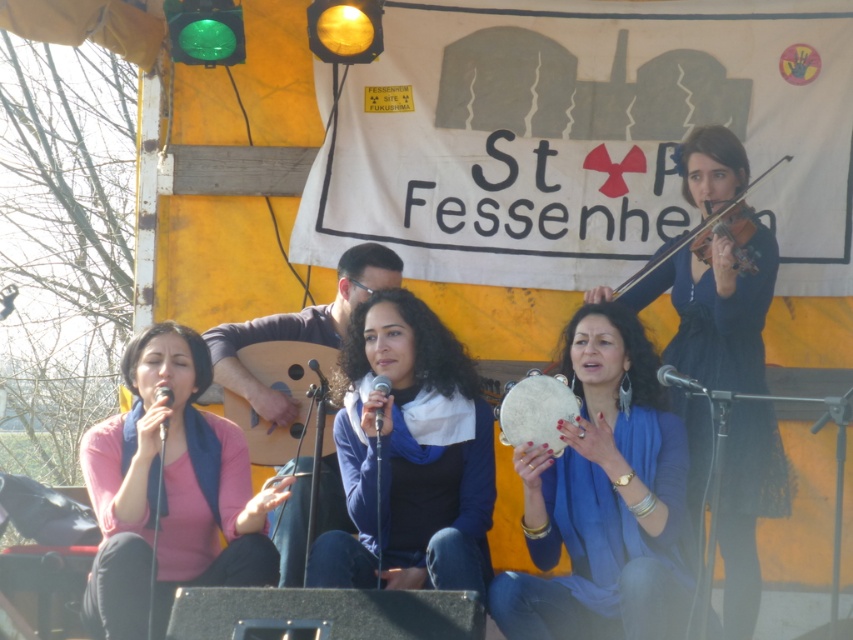
You are a photographer at the event and want to capture a closeup of the blue fabric scarf at center and the wooden acoustic guitar at center in the same frame. Given their sizes, will the scarf appear larger than the guitar in your photo?

The blue fabric scarf at center is much taller than the wooden acoustic guitar at center, so yes, the scarf will appear larger than the guitar in the photo.

You are a photographer standing at the front of the stage. You want to take a photo of the wooden acoustic guitar at center. Where should you position yourself to ensure the guitar is centered in your frame?

To center the wooden acoustic guitar at center in your photo, position yourself directly in line with its coordinates at point (280, 392).

In the scene shown: You are a photographer trying to capture a clear shot of both the wooden acoustic guitar at center and the metallic silver microphone at center during the performance. Since they are both at the center, which one is closer to the camera so you can focus on it first?

The metallic silver microphone at center is behind the wooden acoustic guitar at center, so the wooden acoustic guitar at center is closer to the camera and should be focused on first.